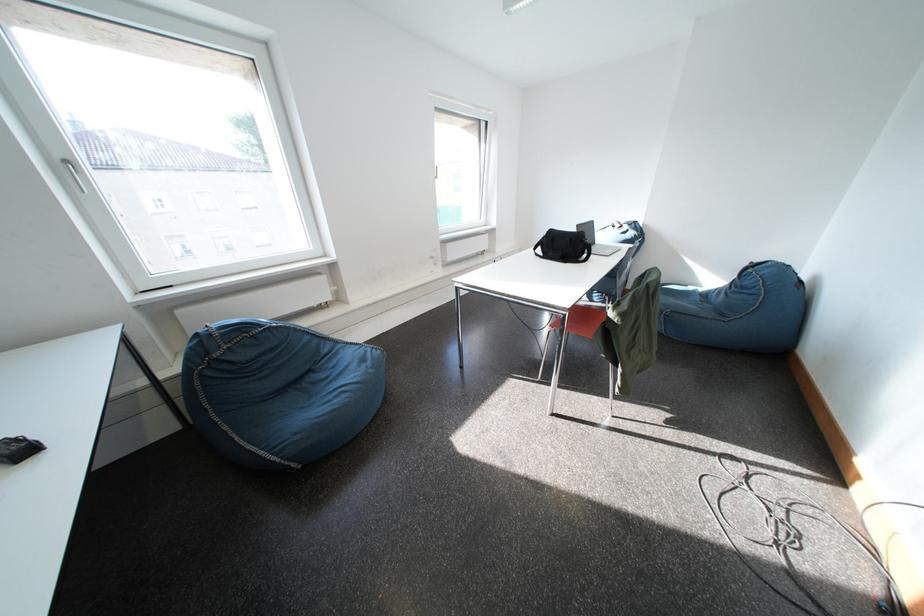
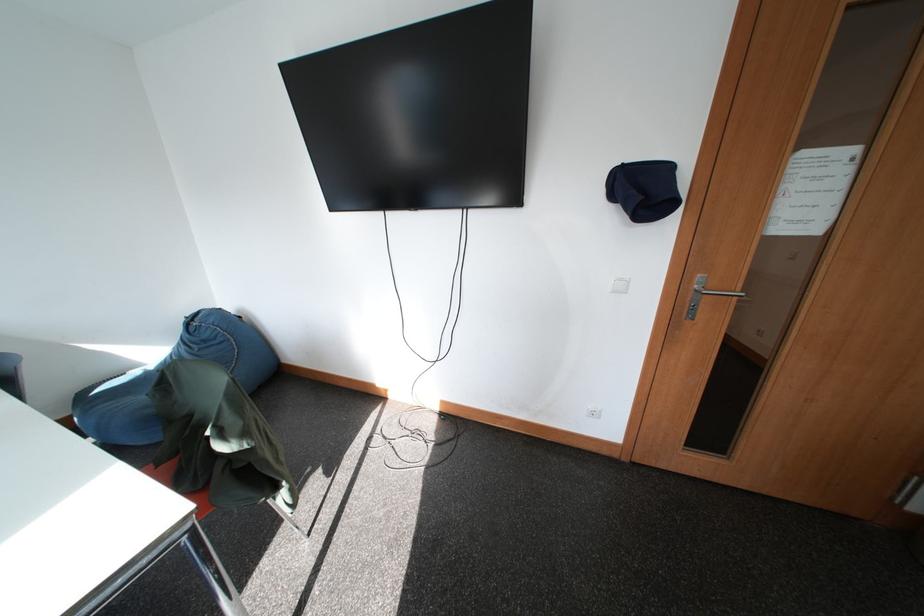
Locate, in the second image, the point that corresponds to pixel 700 292 in the first image.

(146, 377)